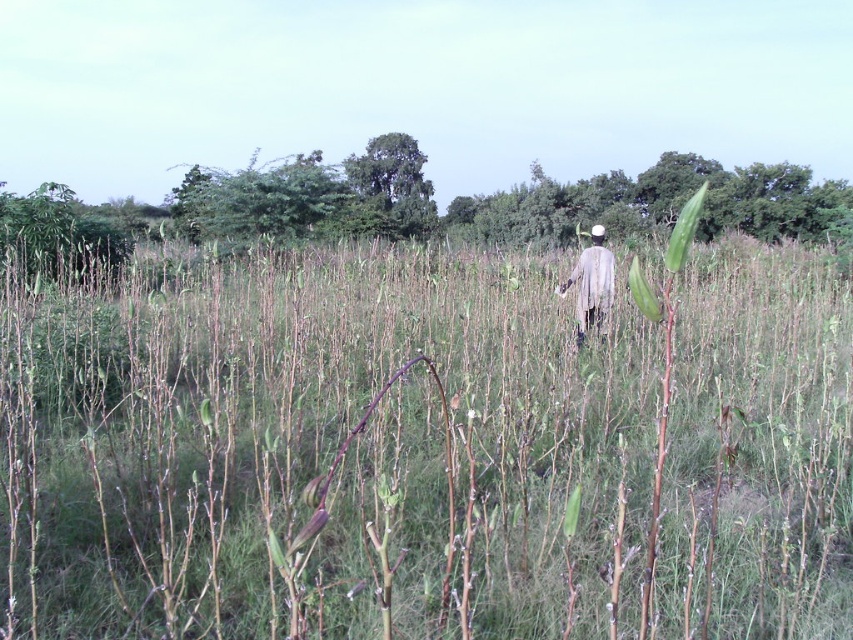
Question: Does green matte grass at center have a larger size compared to light gray fabric at center?

Choices:
 (A) yes
 (B) no

Answer: (B)

Question: Is green matte grass at center to the left of light gray fabric at center from the viewer's perspective?

Choices:
 (A) no
 (B) yes

Answer: (B)

Question: Can you confirm if green matte grass at center is smaller than light gray fabric at center?

Choices:
 (A) no
 (B) yes

Answer: (B)

Question: Among these points, which one is nearest to the camera?

Choices:
 (A) (155, 625)
 (B) (560, 291)

Answer: (A)